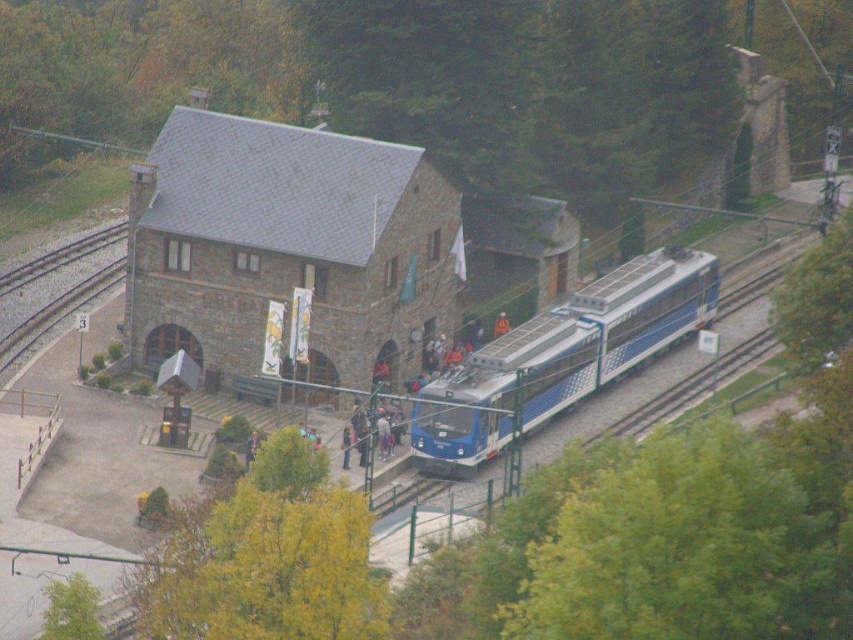
Question: Is green leafy tree at upper center below green leafy tree at right?

Choices:
 (A) no
 (B) yes

Answer: (A)

Question: Does green leafy tree at lower left have a larger size compared to orange fabric person at center?

Choices:
 (A) yes
 (B) no

Answer: (A)

Question: Does green leafy tree at upper center have a smaller size compared to green leafy tree at lower right?

Choices:
 (A) no
 (B) yes

Answer: (A)

Question: Among these objects, which one is farthest from the camera?

Choices:
 (A) green leafy tree at upper center
 (B) green leafy tree at lower right

Answer: (A)

Question: Which point is farther to the camera?

Choices:
 (A) stone textured building at center
 (B) orange fabric person at center
 (C) green leafy tree at right
 (D) gray gravel train track at lower left

Answer: (B)

Question: Estimate the real-world distances between objects in this image. Which object is closer to the green leafy tree at lower right?

Choices:
 (A) green leafy tree at upper center
 (B) orange fabric person at center

Answer: (B)